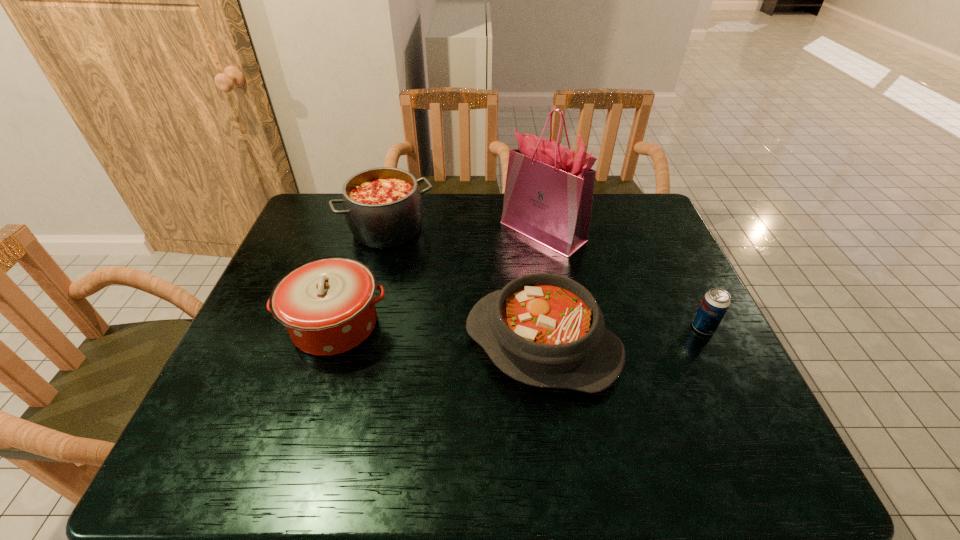
Locate which casserole ranks third in proximity to the shopping bag. Please provide its 2D coordinates. Your answer should be formatted as a tuple, i.e. [(x, y)], where the tuple contains the x and y coordinates of a point satisfying the conditions above.

[(327, 305)]

Identify which casserole is the second nearest to the rightmost object. Please provide its 2D coordinates. Your answer should be formatted as a tuple, i.e. [(x, y)], where the tuple contains the x and y coordinates of a point satisfying the conditions above.

[(383, 207)]